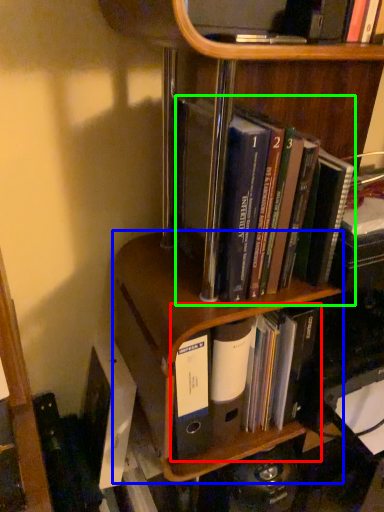
Question: Which object is the farthest from book (highlighted by a red box)? Choose among these: shelf (highlighted by a blue box) or book (highlighted by a green box).

Choices:
 (A) shelf
 (B) book

Answer: (B)